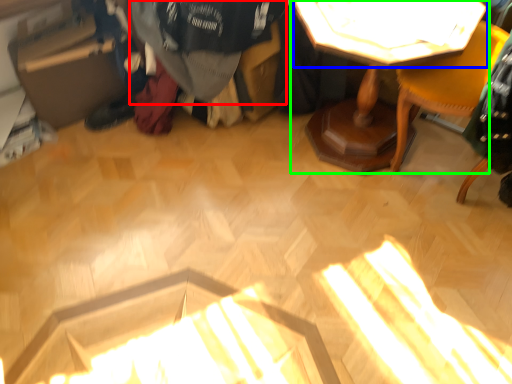
Question: Estimate the real-world distances between objects in this image. Which object is farther from clothing (highlighted by a red box), table top (highlighted by a blue box) or table (highlighted by a green box)?

Choices:
 (A) table top
 (B) table

Answer: (A)